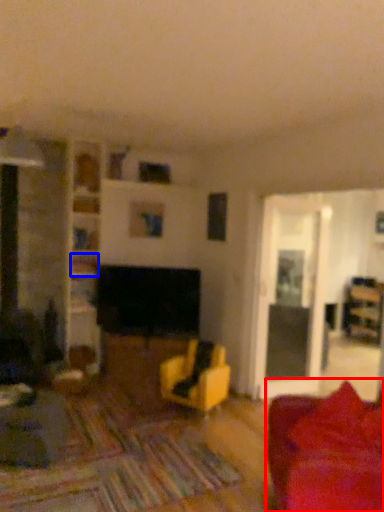
Question: Among these objects, which one is farthest to the camera, studio couch (highlighted by a red box) or shelf (highlighted by a blue box)?

Choices:
 (A) studio couch
 (B) shelf

Answer: (B)